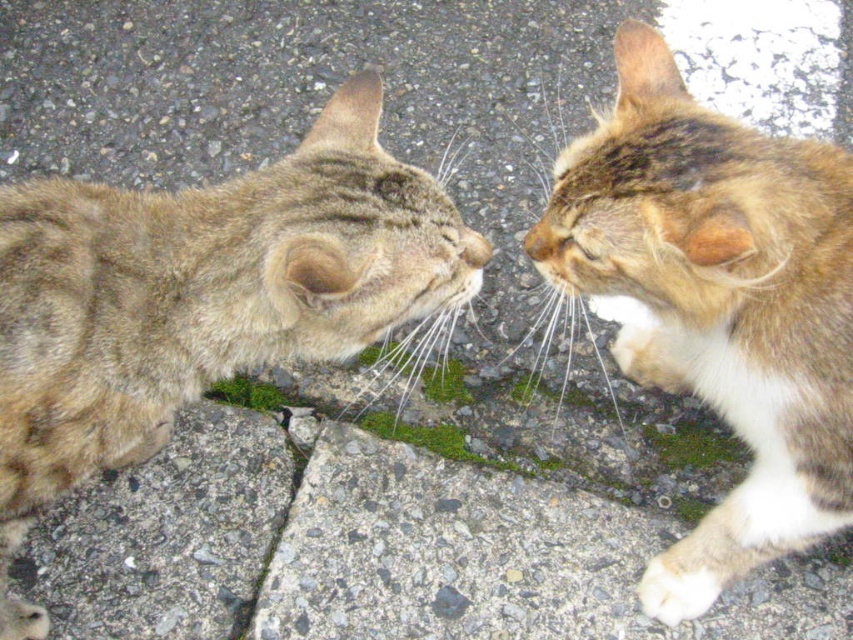
Question: Which point is farther to the camera?

Choices:
 (A) tabby fur cat at right
 (B) tabby fur cat at center
 (C) brown fur nose at center

Answer: (C)

Question: Considering the relative positions of tabby fur cat at center and matte fur nose at center in the image provided, where is tabby fur cat at center located with respect to matte fur nose at center?

Choices:
 (A) left
 (B) right

Answer: (A)

Question: Which is farther from the matte fur nose at center?

Choices:
 (A) brown fur nose at center
 (B) tabby fur cat at right

Answer: (B)

Question: Which object appears closest to the camera in this image?

Choices:
 (A) tabby fur cat at center
 (B) tabby fur cat at right
 (C) matte fur nose at center
 (D) brown fur nose at center

Answer: (A)

Question: Does tabby fur cat at right come behind matte fur nose at center?

Choices:
 (A) yes
 (B) no

Answer: (B)

Question: Is tabby fur cat at right smaller than brown fur nose at center?

Choices:
 (A) yes
 (B) no

Answer: (B)